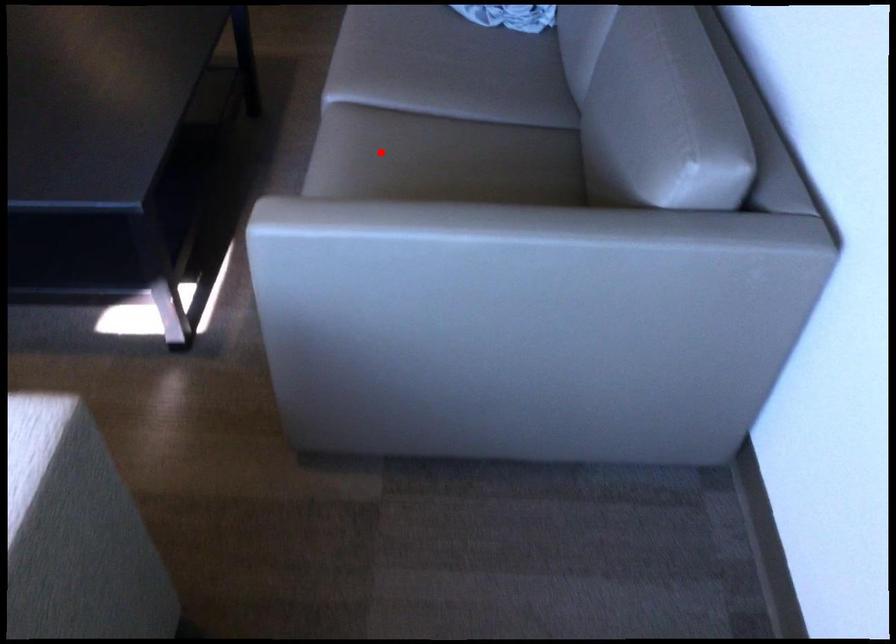
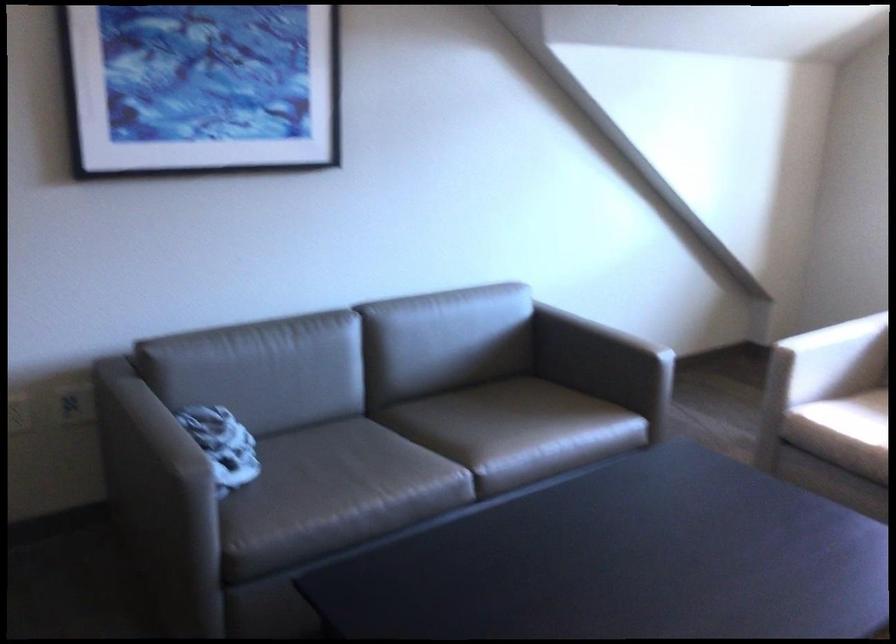
The point at the highlighted location is marked in the first image. Where is the corresponding point in the second image?

(497, 430)